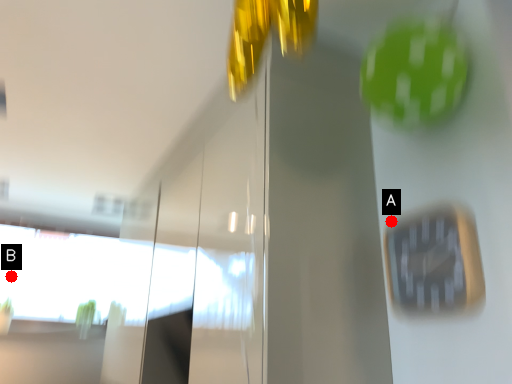
Question: Two points are circled on the image, labeled by A and B beside each circle. Which of the following is the farthest from the observer?

Choices:
 (A) A is further
 (B) B is further

Answer: (B)